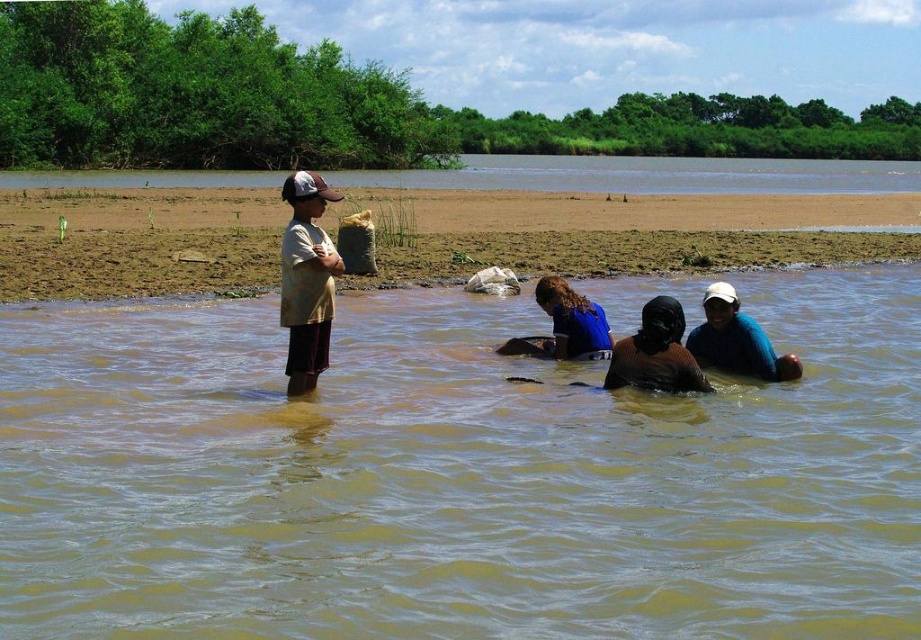
You are standing at the point labeled as point (648, 176) in the image. Looking around, you see a brown sandy riverbank at upper center. What direction should you walk to reach the nearest person in the water?

The nearest person is the man on the left side of the frame. To reach him from the brown sandy riverbank at upper center, you should walk towards the left direction.

You are a photographer trying to capture the scene of the group in the river. You want to ensure the brown muddy ground at center and the brown matte headscarf at center are both visible in your shot. Based on their positions, which object is covering the other?

The brown muddy ground at center is positioned over brown matte headscarf at center, so the ground is covering the headscarf.

Based on the scene described, can you determine if the matte yellow shirt at left has a larger width compared to the brown matte headscarf at center?

The matte yellow shirt at left might be wider than brown matte headscarf at center according to the description provided.